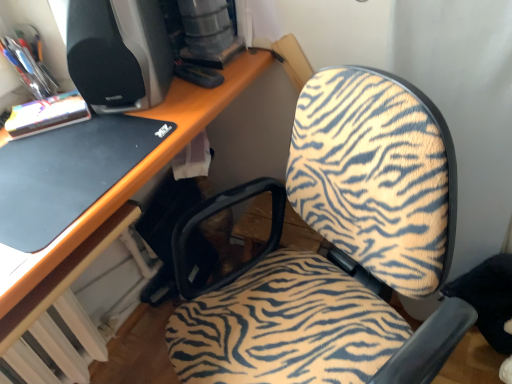
Question: Considering the positions of black plastic desktop computer at upper left and black matte laptop at left in the image, is black plastic desktop computer at upper left taller or shorter than black matte laptop at left?

Choices:
 (A) tall
 (B) short

Answer: (A)

Question: From a real-world perspective, is black plastic desktop computer at upper left positioned above or below black matte laptop at left?

Choices:
 (A) below
 (B) above

Answer: (B)

Question: Based on their relative distances, which object is farther from the black matte laptop at left?

Choices:
 (A) black plastic desktop computer at upper left
 (B) zebra-patterned fabric chair at center

Answer: (B)

Question: Which object is the farthest from the zebra-patterned fabric chair at center?

Choices:
 (A) black plastic desktop computer at upper left
 (B) black matte laptop at left

Answer: (A)